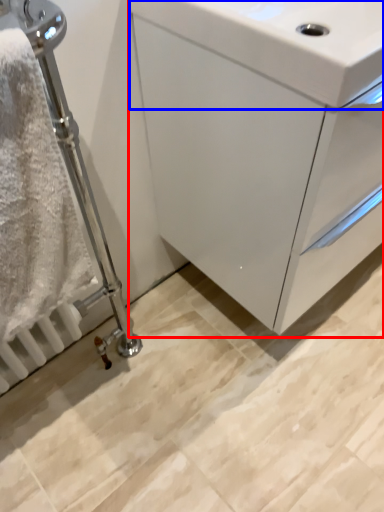
Question: Which of the following is the closest to the observer, bathroom cabinet (highlighted by a red box) or sink (highlighted by a blue box)?

Choices:
 (A) bathroom cabinet
 (B) sink

Answer: (B)